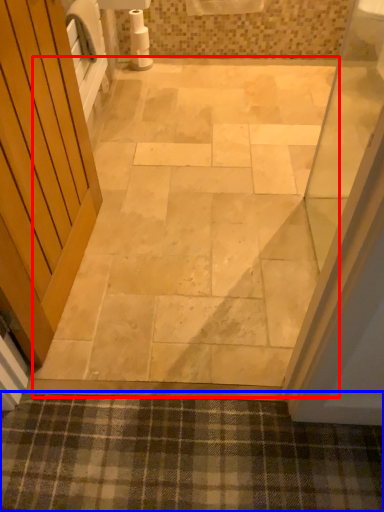
Question: Among these objects, which one is farthest to the camera, path (highlighted by a red box) or bath mat (highlighted by a blue box)?

Choices:
 (A) path
 (B) bath mat

Answer: (A)